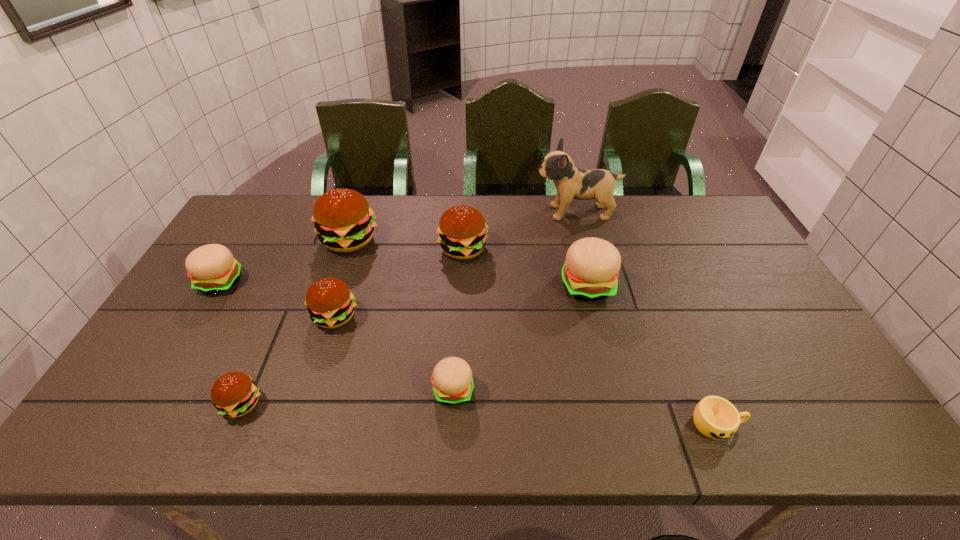
You are a GUI agent. You are given a task and a screenshot of the screen. Output one action in this format:
    pyautogui.click(x=<x>, y=<y>)
    Task: Click on the puppy
    This screenshot has width=960, height=540.
    Given the screenshot: What is the action you would take?
    point(571,183)

Find the location of a particular element. the tallest hamburger is located at coordinates (343, 220).

Where is `the biggest brown hamburger`? the biggest brown hamburger is located at coordinates (343, 220).

This screenshot has width=960, height=540. What are the coordinates of `the second biggest brown hamburger` in the screenshot? It's located at (462, 231).

Where is `the rightmost beige hamburger`? Image resolution: width=960 pixels, height=540 pixels. the rightmost beige hamburger is located at coordinates (590, 272).

At what (x,y) coordinates should I click in order to perform the action: click on the biggest beige hamburger. Please return your answer as a coordinate pair (x, y). Looking at the image, I should click on (590, 272).

Identify the location of the second smallest brown hamburger. Image resolution: width=960 pixels, height=540 pixels. (330, 304).

The image size is (960, 540). Find the location of `the second smallest beige hamburger`. the second smallest beige hamburger is located at coordinates (212, 269).

Identify the location of the leftmost object. This screenshot has height=540, width=960. (212, 269).

Find the location of a particular element. the smallest brown hamburger is located at coordinates (234, 394).